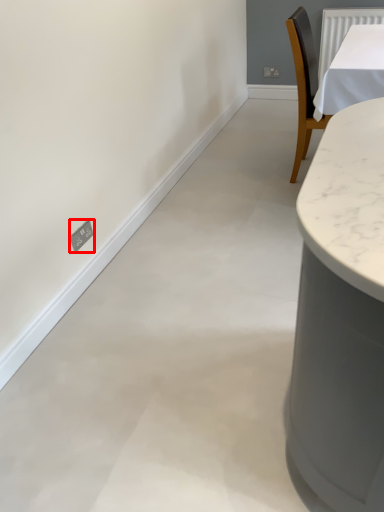
Question: Considering the relative positions of electric outlet (annotated by the red box) and backdrop in the image provided, where is electric outlet (annotated by the red box) located with respect to the staircase?

Choices:
 (A) left
 (B) right

Answer: (A)